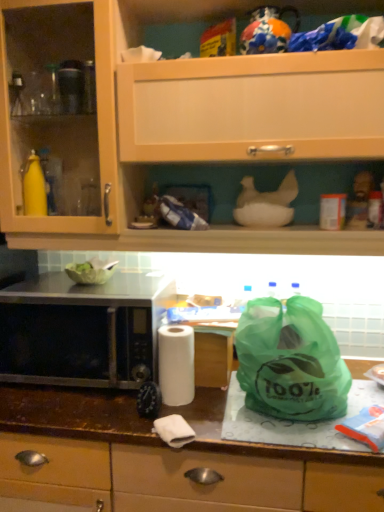
Question: Is matte wood cabinet at upper center inside brown laminate countertop at center?

Choices:
 (A) no
 (B) yes

Answer: (A)

Question: Can you confirm if brown laminate countertop at center is shorter than matte wood cabinet at upper center?

Choices:
 (A) yes
 (B) no

Answer: (A)

Question: Does brown laminate countertop at center have a greater height compared to matte wood cabinet at upper center?

Choices:
 (A) no
 (B) yes

Answer: (A)

Question: Is brown laminate countertop at center looking in the opposite direction of matte wood cabinet at upper center?

Choices:
 (A) yes
 (B) no

Answer: (B)

Question: Can you confirm if brown laminate countertop at center is thinner than matte wood cabinet at upper center?

Choices:
 (A) yes
 (B) no

Answer: (B)

Question: Would you say brown laminate countertop at center is outside matte wood cabinet at upper center?

Choices:
 (A) yes
 (B) no

Answer: (A)

Question: Can you confirm if white matte paper towel at center is shorter than brown laminate countertop at center?

Choices:
 (A) yes
 (B) no

Answer: (A)

Question: Is white matte paper towel at center oriented away from brown laminate countertop at center?

Choices:
 (A) yes
 (B) no

Answer: (B)

Question: Is white matte paper towel at center closer to the viewer compared to brown laminate countertop at center?

Choices:
 (A) yes
 (B) no

Answer: (B)

Question: Does white matte paper towel at center have a lesser width compared to brown laminate countertop at center?

Choices:
 (A) yes
 (B) no

Answer: (A)

Question: Considering the relative sizes of white matte paper towel at center and brown laminate countertop at center in the image provided, is white matte paper towel at center smaller than brown laminate countertop at center?

Choices:
 (A) no
 (B) yes

Answer: (B)

Question: Is white matte paper towel at center far from brown laminate countertop at center?

Choices:
 (A) no
 (B) yes

Answer: (A)

Question: Would you say white matte paper towel at center is outside green plastic bag at right?

Choices:
 (A) yes
 (B) no

Answer: (A)